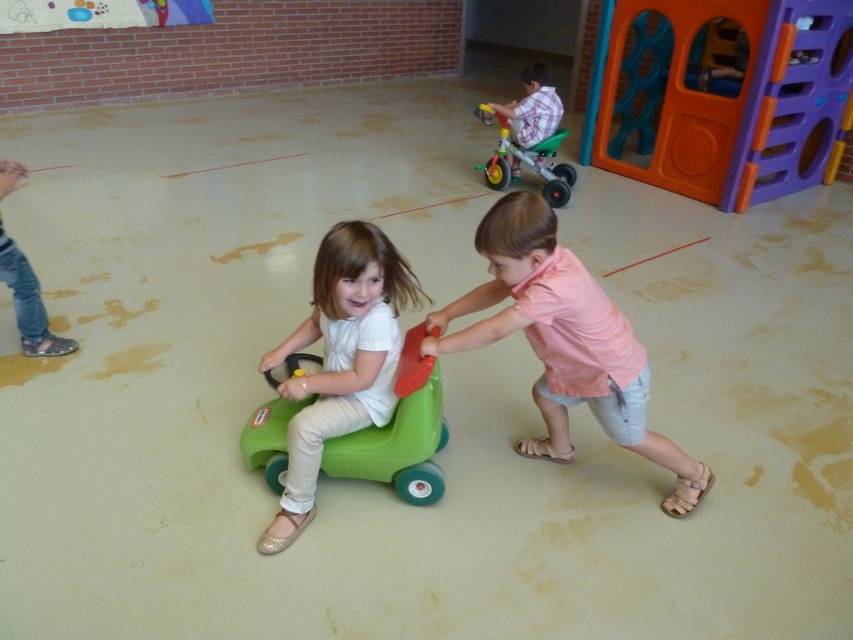
Question: Which point is farther to the camera?

Choices:
 (A) pink cotton shirt at center
 (B) green matte toy car at center

Answer: (B)

Question: From the image, what is the correct spatial relationship of orange plastic playhouse at right in relation to green plastic tricycle at upper right?

Choices:
 (A) above
 (B) below

Answer: (A)

Question: Is orange plastic playhouse at right to the right of green plastic tricycle at upper right from the viewer's perspective?

Choices:
 (A) no
 (B) yes

Answer: (B)

Question: Does orange plastic playhouse at right appear on the left side of plaid cotton shirt at upper right?

Choices:
 (A) no
 (B) yes

Answer: (A)

Question: Which object is positioned farthest from the plaid cotton shirt at upper right?

Choices:
 (A) orange plastic playhouse at right
 (B) green matte toy car at center
 (C) pink cotton shirt at center
 (D) green plastic tricycle at upper right

Answer: (B)

Question: Among these points, which one is nearest to the camera?

Choices:
 (A) (323, 410)
 (B) (762, 81)
 (C) (521, 102)
 (D) (502, 186)

Answer: (A)